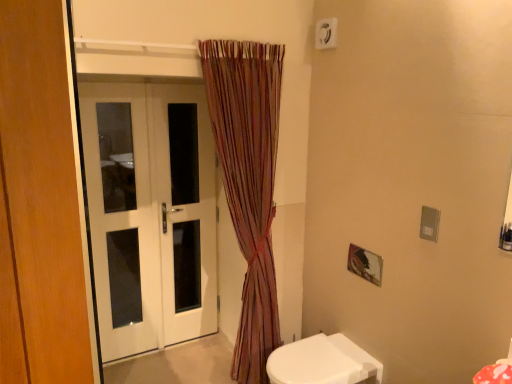
Describe the element at coordinates (322, 362) in the screenshot. The width and height of the screenshot is (512, 384). I see `white glossy toilet at lower right` at that location.

Where is `white plastic electric outlet at upper center`? white plastic electric outlet at upper center is located at coordinates (326, 33).

The image size is (512, 384). What do you see at coordinates (248, 182) in the screenshot?
I see `striped fabric curtain at center` at bounding box center [248, 182].

Locate an element on the screen. white glossy door at left is located at coordinates (150, 213).

Where is `white glossy door at left`? The image size is (512, 384). white glossy door at left is located at coordinates (185, 208).

Identify the location of white glossy toilet at lower right. (322, 362).

Consider the image. From a real-world perspective, is white glossy toilet at lower right positioned over white glossy door at left based on gravity?

No, from a real-world perspective, white glossy toilet at lower right is not over white glossy door at left

Is white glossy toilet at lower right smaller than white glossy door at left?

No, white glossy toilet at lower right is not smaller than white glossy door at left.

Find the location of a particular element. This screenshot has width=512, height=384. door that appears above the white glossy toilet at lower right (from a real-world perspective) is located at coordinates (150, 213).

Would you say white glossy toilet at lower right is to the left or to the right of white glossy door at left in the picture?

Clearly, white glossy toilet at lower right is on the right of white glossy door at left in the image.

Does point (244, 316) come closer to viewer compared to point (138, 218)?

Yes, it is in front of point (138, 218).

Looking at this image, in terms of width, does striped fabric curtain at center look wider or thinner when compared to white glossy door at left?

striped fabric curtain at center is wider than white glossy door at left.

This screenshot has width=512, height=384. Identify the location of curtain above the white glossy door at left (from the image's perspective). (248, 182).

Could you tell me if striped fabric curtain at center is turned towards white glossy door at left?

No, striped fabric curtain at center is not aimed at white glossy door at left.

Which object is closer to the camera taking this photo, striped fabric curtain at center or white plastic electric outlet at upper center?

Positioned in front is striped fabric curtain at center.

Who is taller, striped fabric curtain at center or white plastic electric outlet at upper center?

striped fabric curtain at center is taller.

Does striped fabric curtain at center appear on the right side of white plastic electric outlet at upper center?

In fact, striped fabric curtain at center is to the left of white plastic electric outlet at upper center.

From the picture: From a real-world perspective, is striped fabric curtain at center physically below white plastic electric outlet at upper center?

Correct, in the physical world, striped fabric curtain at center is lower than white plastic electric outlet at upper center.

Can you confirm if white glossy door at left is bigger than white plastic electric outlet at upper center?

Yes.

Does point (183, 157) come farther from viewer compared to point (335, 45)?

That is True.

From a real-world perspective, is white glossy door at left physically located above or below white plastic electric outlet at upper center?

Clearly, from a real-world perspective, white glossy door at left is below white plastic electric outlet at upper center.

Is white glossy door at left positioned with its back to white plastic electric outlet at upper center?

No.

Is point (193, 312) closer or farther from the camera than point (360, 368)?

Clearly, point (193, 312) is more distant from the camera than point (360, 368).

From the image's perspective, relative to white glossy toilet at lower right, is white glossy door at left above or below?

From the image's perspective, white glossy door at left appears above white glossy toilet at lower right.

Is white glossy door at left at the left side of white glossy toilet at lower right?

Yes.

Considering the sizes of objects white glossy door at left and white glossy toilet at lower right in the image provided, who is shorter, white glossy door at left or white glossy toilet at lower right?

white glossy toilet at lower right.

Looking at this image, considering the relative sizes of white plastic electric outlet at upper center and striped fabric curtain at center in the image provided, is white plastic electric outlet at upper center wider than striped fabric curtain at center?

No, white plastic electric outlet at upper center is not wider than striped fabric curtain at center.

What's the angular difference between white plastic electric outlet at upper center and striped fabric curtain at center's facing directions?

The angle between the facing direction of white plastic electric outlet at upper center and the facing direction of striped fabric curtain at center is 91 degrees.

Considering the relative positions of white plastic electric outlet at upper center and striped fabric curtain at center in the image provided, is white plastic electric outlet at upper center to the left or to the right of striped fabric curtain at center?

Based on their positions, white plastic electric outlet at upper center is located to the right of striped fabric curtain at center.

Find the location of a particular element. electric outlet that is on the right side of striped fabric curtain at center is located at coordinates (326, 33).

Is white plastic electric outlet at upper center at the left side of white glossy door at left?

No, white plastic electric outlet at upper center is not to the left of white glossy door at left.

Considering the sizes of objects white plastic electric outlet at upper center and white glossy door at left in the image provided, who is thinner, white plastic electric outlet at upper center or white glossy door at left?

white plastic electric outlet at upper center.

Based on the photo, is white plastic electric outlet at upper center next to white glossy door at left?

There is a gap between white plastic electric outlet at upper center and white glossy door at left.

Who is shorter, white plastic electric outlet at upper center or white glossy door at left?

With less height is white plastic electric outlet at upper center.

Identify the location of toilet below the white glossy door at left (from the image's perspective). The height and width of the screenshot is (384, 512). (322, 362).

Where is `curtain that is above the white glossy door at left (from the image's perspective)`? The image size is (512, 384). curtain that is above the white glossy door at left (from the image's perspective) is located at coordinates (248, 182).

From the picture: When comparing their distances from striped fabric curtain at center, does white glossy door at left or white glossy door at left seem further?

white glossy door at left is positioned further to the anchor striped fabric curtain at center.

Based on their spatial positions, is white plastic electric outlet at upper center or white glossy toilet at lower right closer to white glossy door at left?

Among the two, white glossy toilet at lower right is located nearer to white glossy door at left.

Considering their positions, is white glossy door at left positioned further to white glossy door at left than white glossy toilet at lower right?

white glossy toilet at lower right.

From the picture: Looking at the image, which one is located closer to white glossy door at left, white plastic electric outlet at upper center or white glossy door at left?

Among the two, white glossy door at left is located nearer to white glossy door at left.

Which object lies nearer to the anchor point white glossy door at left, striped fabric curtain at center or white glossy door at left?

white glossy door at left lies closer to white glossy door at left than the other object.

Considering their positions, is striped fabric curtain at center positioned closer to white glossy toilet at lower right than white glossy door at left?

The object closer to white glossy toilet at lower right is striped fabric curtain at center.

When comparing their distances from white plastic electric outlet at upper center, does striped fabric curtain at center or white glossy toilet at lower right seem closer?

Among the two, striped fabric curtain at center is located nearer to white plastic electric outlet at upper center.

Looking at the image, which one is located closer to striped fabric curtain at center, white glossy door at left or white plastic electric outlet at upper center?

white glossy door at left.

Locate an element on the screen. The width and height of the screenshot is (512, 384). screen door between white glossy door at left and white glossy toilet at lower right is located at coordinates (185, 208).

Where is `screen door between striped fabric curtain at center and white glossy toilet at lower right in the up-down direction`? The width and height of the screenshot is (512, 384). screen door between striped fabric curtain at center and white glossy toilet at lower right in the up-down direction is located at coordinates click(x=185, y=208).

This screenshot has height=384, width=512. In order to click on door between white plastic electric outlet at upper center and white glossy door at left in the vertical direction in this screenshot , I will do `click(150, 213)`.

Locate an element on the screen. This screenshot has height=384, width=512. curtain between white plastic electric outlet at upper center and white glossy toilet at lower right in the up-down direction is located at coordinates coord(248,182).